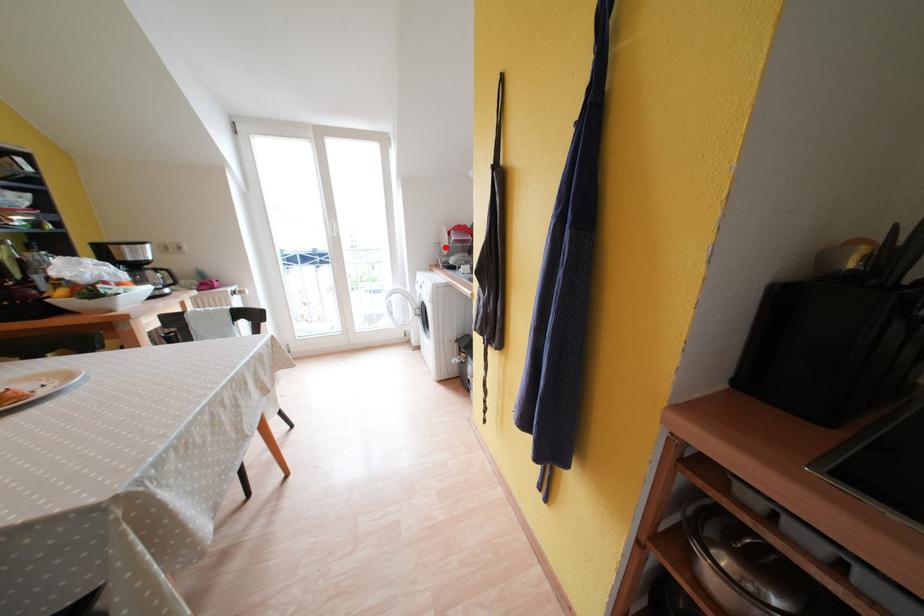
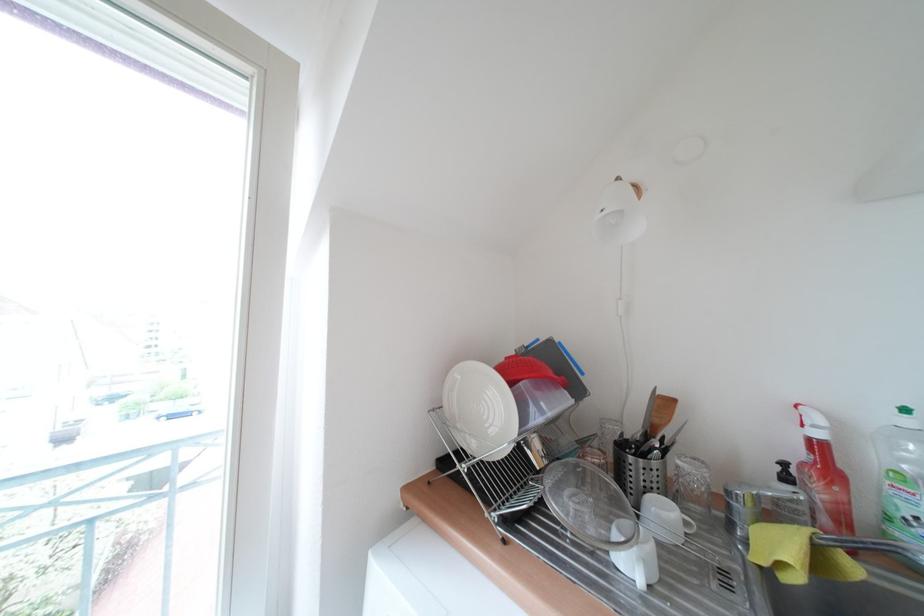
Where in the second image is the point corresponding to the highlighted location from the first image?

(444, 413)